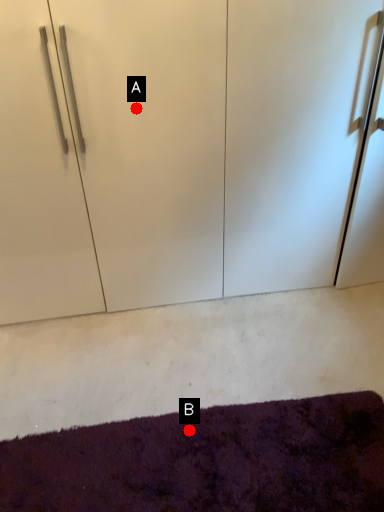
Question: Two points are circled on the image, labeled by A and B beside each circle. Which of the following is the farthest from the observer?

Choices:
 (A) A is further
 (B) B is further

Answer: (A)